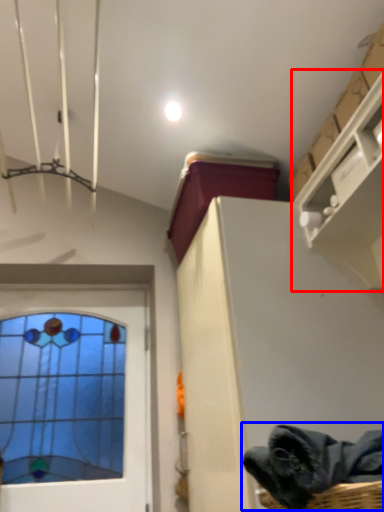
Question: Among these objects, which one is farthest to the camera, shelf (highlighted by a red box) or clothing (highlighted by a blue box)?

Choices:
 (A) shelf
 (B) clothing

Answer: (A)